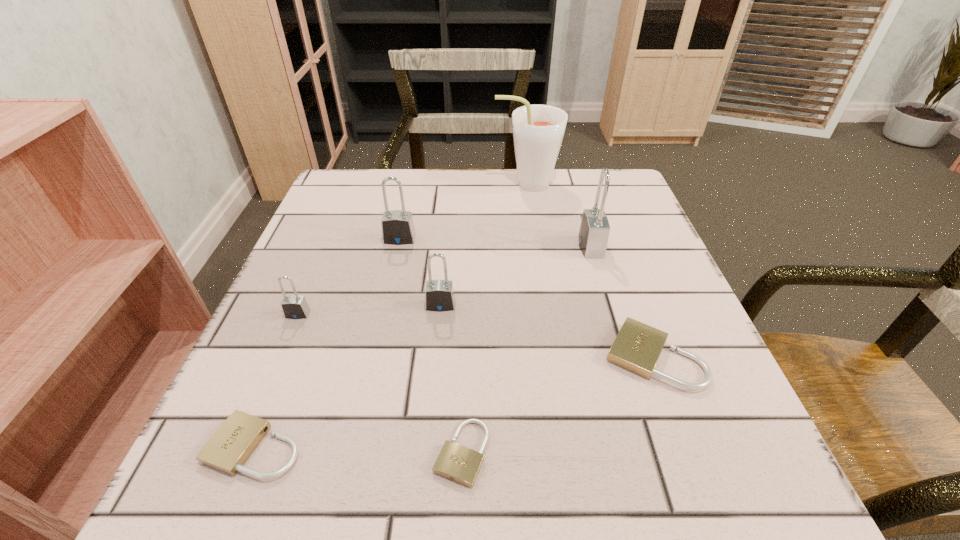
The height and width of the screenshot is (540, 960). In order to click on vacant space situated on the shackle of the seventh shortest object in this screenshot , I will do `click(555, 246)`.

Where is `vacant space located 0.060m on the shackle of the seventh shortest object`? The width and height of the screenshot is (960, 540). vacant space located 0.060m on the shackle of the seventh shortest object is located at coordinates (550, 246).

I want to click on free space located 0.390m on the shackle of the sixth shortest padlock, so click(x=362, y=410).

In order to click on vacant region located on the shackle of the second gray padlock from right to left in this screenshot , I will do coord(425,474).

The image size is (960, 540). In order to click on vacant area situated on the shackle of the leftmost gray padlock in this screenshot , I will do `click(265, 393)`.

Locate an element on the screen. vacant space situated 0.280m on the back of the third shortest padlock is located at coordinates (607, 230).

Identify the location of vacant area situated 0.100m on the back of the second shortest padlock. (290, 360).

Locate an element on the screen. This screenshot has height=540, width=960. free space located 0.140m on the left of the shortest padlock is located at coordinates (330, 453).

Where is `object present at the far edge`? The width and height of the screenshot is (960, 540). object present at the far edge is located at coordinates (538, 130).

You are a GUI agent. You are given a task and a screenshot of the screen. Output one action in this format:
    pyautogui.click(x=<x>, y=<y>)
    Task: Click on the object situated at the near left corner
    
    Given the screenshot: What is the action you would take?
    pyautogui.click(x=228, y=449)